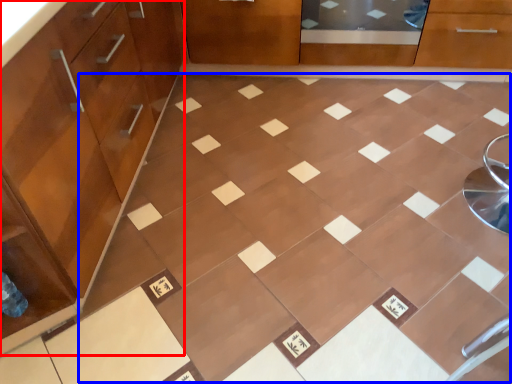
Question: Which of the following is the closest to the observer, cabinetry (highlighted by a red box) or ceramic tile (highlighted by a blue box)?

Choices:
 (A) cabinetry
 (B) ceramic tile

Answer: (A)